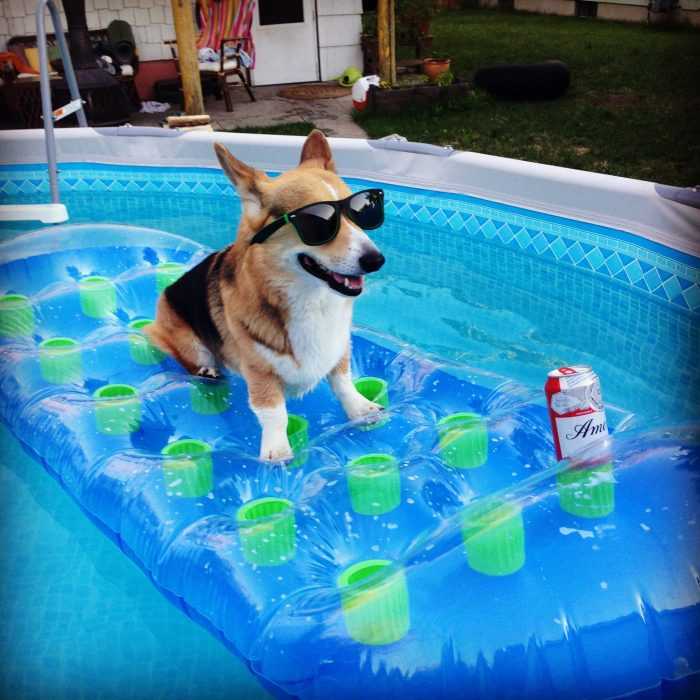
Image resolution: width=700 pixels, height=700 pixels. I want to click on chair, so click(x=206, y=50).